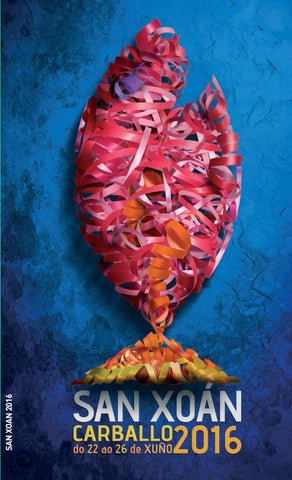
At what (x,y) coordinates should I click in order to perform the action: click on focus of light source. Please return your answer as a coordinate pair (x, y). Image resolution: width=292 pixels, height=480 pixels. Looking at the image, I should click on (275, 29).